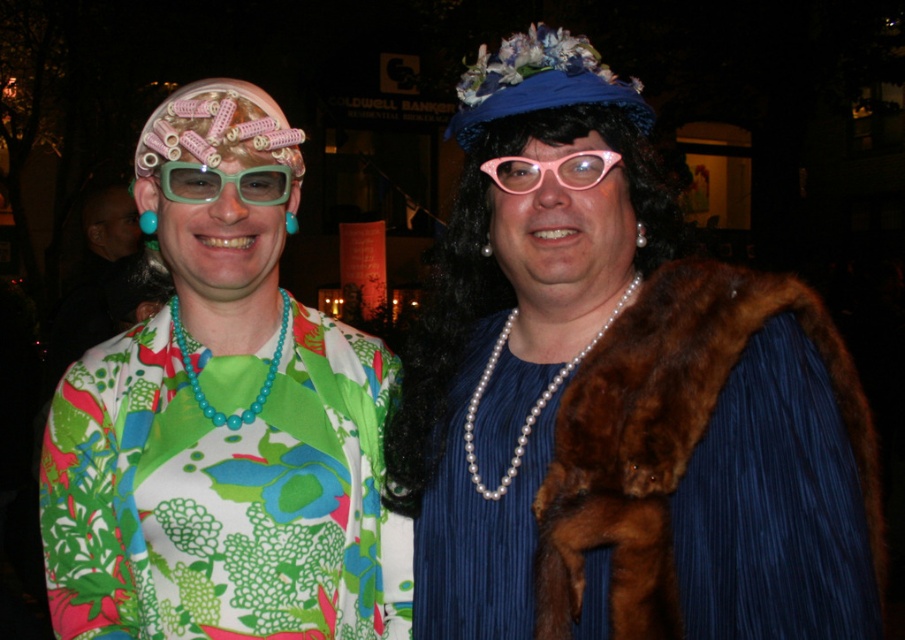
Is matte plastic wig at left in front of matte green plastic goggles at upper left?

Yes.

Describe the element at coordinates (222, 426) in the screenshot. The height and width of the screenshot is (640, 905). I see `matte plastic wig at left` at that location.

Locate an element on the screen. This screenshot has width=905, height=640. matte plastic wig at left is located at coordinates (222, 426).

Does brown fur coat at right have a lesser width compared to matte green plastic goggles at upper left?

No.

In the scene shown: Can you confirm if brown fur coat at right is positioned above matte green plastic goggles at upper left?

No, brown fur coat at right is not above matte green plastic goggles at upper left.

Is point (682, 266) positioned in front of point (173, 189)?

Yes, it is.

You are a GUI agent. You are given a task and a screenshot of the screen. Output one action in this format:
    pyautogui.click(x=<x>, y=<y>)
    Task: Click on the brown fur coat at right
    The width and height of the screenshot is (905, 640).
    Given the screenshot: What is the action you would take?
    pyautogui.click(x=665, y=433)

Is matte plastic wig at left positioned at the back of brown fur coat at right?

That is True.

Who is positioned more to the left, matte plastic wig at left or brown fur coat at right?

From the viewer's perspective, matte plastic wig at left appears more on the left side.

Is point (237, 257) positioned behind point (555, 483)?

Yes, it is behind point (555, 483).

In order to click on matte plastic wig at left in this screenshot , I will do `click(222, 426)`.